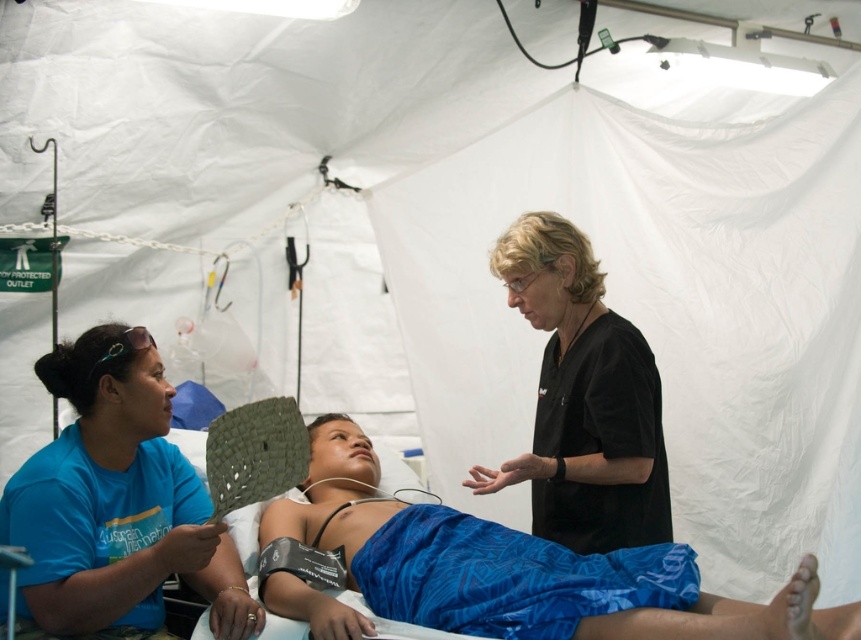
Does blue fabric at center have a smaller size compared to black scrubs at center?

No.

Where is `blue fabric at center`? blue fabric at center is located at coordinates (554, 582).

Between point (286, 611) and point (104, 621), which one is positioned behind?

Point (286, 611)

Does blue fabric at center have a smaller size compared to blue fabric shirt at left?

Incorrect, blue fabric at center is not smaller in size than blue fabric shirt at left.

Is point (660, 548) farther from viewer compared to point (146, 422)?

No, it is in front of (146, 422).

Locate an element on the screen. The image size is (861, 640). blue fabric at center is located at coordinates (554, 582).

Can you confirm if blue fabric shirt at left is wider than black scrubs at center?

Yes.

Can you confirm if blue fabric shirt at left is thinner than black scrubs at center?

Incorrect, blue fabric shirt at left's width is not less than black scrubs at center's.

What do you see at coordinates (116, 500) in the screenshot? I see `blue fabric shirt at left` at bounding box center [116, 500].

Identify the location of blue fabric shirt at left. (116, 500).